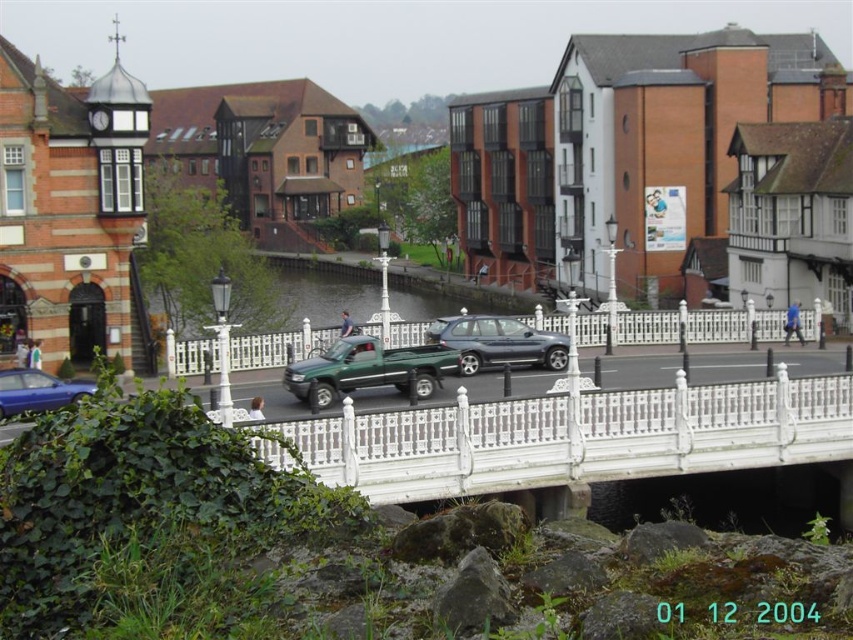
Can you confirm if green matte truck at center is thinner than satin silver metallic car at center?

No, green matte truck at center is not thinner than satin silver metallic car at center.

Where is `green matte truck at center`? Image resolution: width=853 pixels, height=640 pixels. green matte truck at center is located at coordinates (368, 369).

Is point (431, 355) in front of point (512, 336)?

Yes, point (431, 355) is in front of point (512, 336).

This screenshot has height=640, width=853. Find the location of `green matte truck at center`. green matte truck at center is located at coordinates (368, 369).

Image resolution: width=853 pixels, height=640 pixels. What do you see at coordinates (576, 436) in the screenshot?
I see `white wrought iron bridge at center` at bounding box center [576, 436].

Does white wrought iron bridge at center have a larger size compared to green matte truck at center?

Indeed, white wrought iron bridge at center has a larger size compared to green matte truck at center.

At what (x,y) coordinates should I click in order to perform the action: click on white wrought iron bridge at center. Please return your answer as a coordinate pair (x, y). Looking at the image, I should click on (576, 436).

Which is above, white wrought iron bridge at center or satin silver metallic car at center?

satin silver metallic car at center is higher up.

Does white wrought iron bridge at center have a lesser width compared to satin silver metallic car at center?

No, white wrought iron bridge at center is not thinner than satin silver metallic car at center.

Measure the distance between point (344, 458) and camera.

39.54 meters

What are the coordinates of `white wrought iron bridge at center` in the screenshot? It's located at (576, 436).